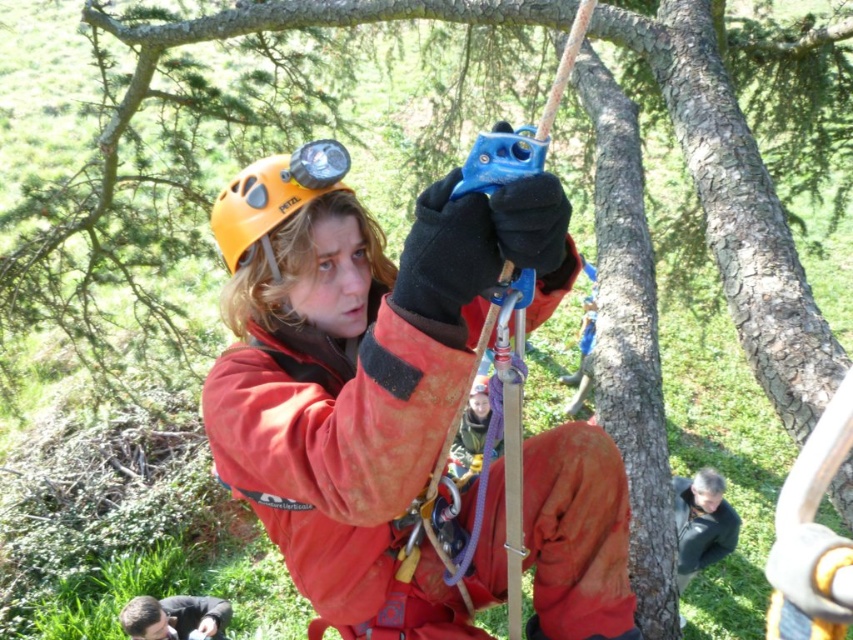
You are an observer looking at the image of a tree climber. The climber has a dark brown leather jacket at lower left and a matte yellow helmet at upper center. Which object is closer to you, the observer?

The dark brown leather jacket at lower left is closer to you because it is in front of the matte yellow helmet at upper center.

Based on the scene description, which object is wider, the matte orange jacket at center or the matte yellow helmet at upper center?

The matte orange jacket at center is wider than the matte yellow helmet at upper center according to the description.